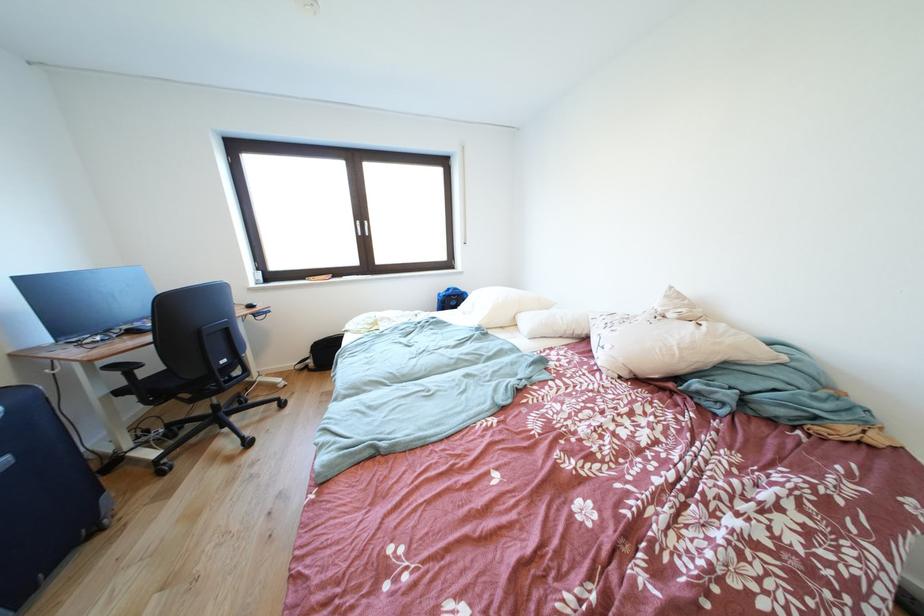
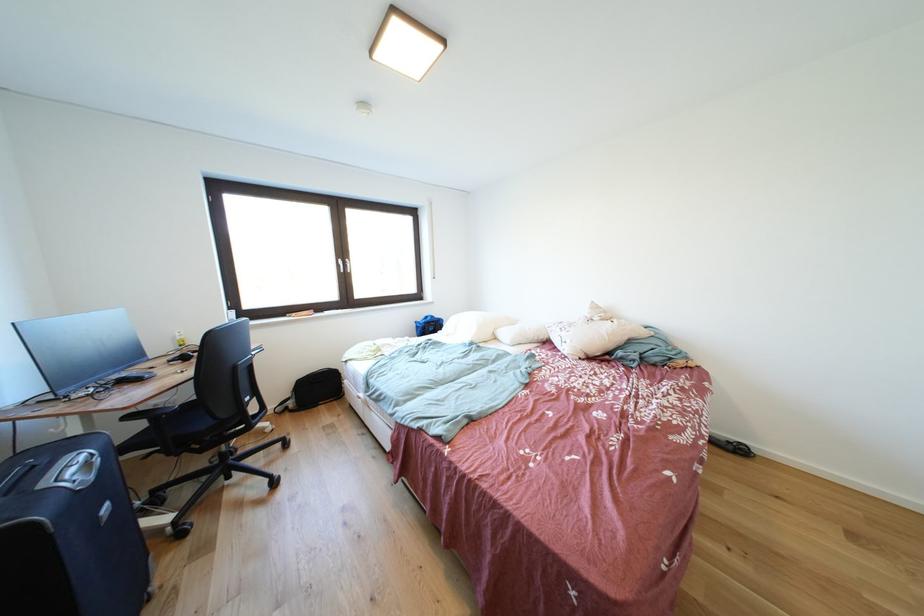
The point at (614, 337) is marked in the first image. Where is the corresponding point in the second image?

(572, 338)